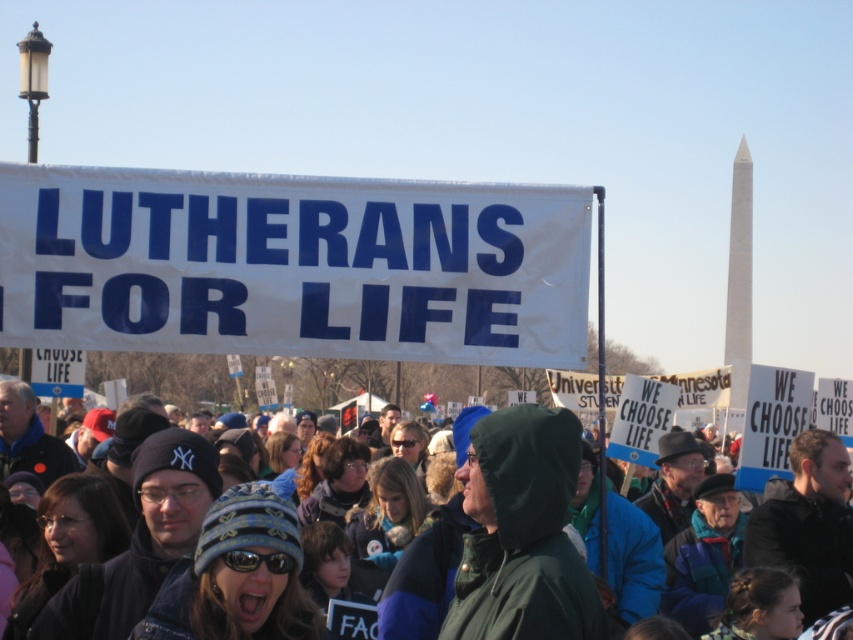
Question: Which object is closer to the camera taking this photo?

Choices:
 (A) white paper banner at center
 (B) green hooded jacket at center

Answer: (B)

Question: Does white paper banner at center appear on the left side of green hooded jacket at center?

Choices:
 (A) no
 (B) yes

Answer: (B)

Question: From the image, what is the correct spatial relationship of white paper banner at center in relation to green hooded jacket at center?

Choices:
 (A) left
 (B) right

Answer: (A)

Question: Which point appears closest to the camera in this image?

Choices:
 (A) (811, 593)
 (B) (9, 227)

Answer: (B)

Question: Which of the following is the farthest from the observer?

Choices:
 (A) green hooded jacket at center
 (B) white paper banner at center

Answer: (B)

Question: Is white paper banner at center further to camera compared to green hooded jacket at center?

Choices:
 (A) no
 (B) yes

Answer: (B)